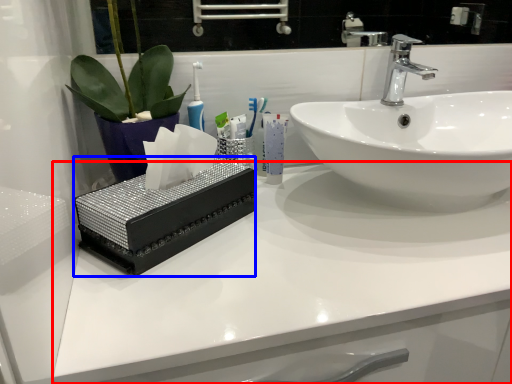
Question: Which point is closer to the camera, counter top (highlighted by a red box) or box (highlighted by a blue box)?

Choices:
 (A) counter top
 (B) box

Answer: (A)